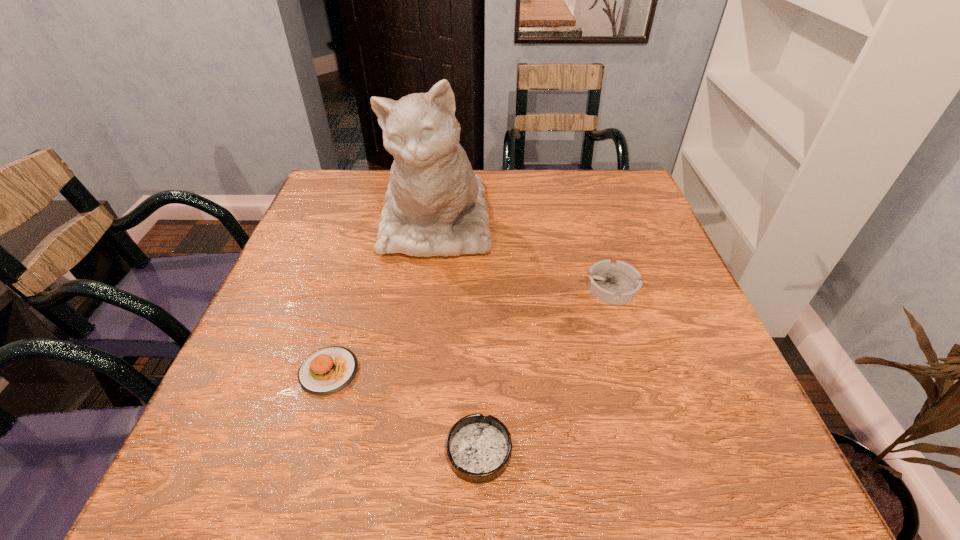
Find the location of a particular element. blank space at the far right corner of the desktop is located at coordinates (606, 208).

In order to click on free space between the food and the cat in this screenshot , I will do `click(382, 297)`.

Locate an element on the screen. The image size is (960, 540). free space that is in between the nearest object and the third farthest object is located at coordinates (404, 411).

Identify the location of free space between the rightmost object and the third farthest object. The width and height of the screenshot is (960, 540). (469, 329).

The width and height of the screenshot is (960, 540). I want to click on free area in between the third farthest object and the nearest object, so click(404, 411).

You are a GUI agent. You are given a task and a screenshot of the screen. Output one action in this format:
    pyautogui.click(x=<x>, y=<y>)
    Task: Click on the unoccupied area between the cat and the right ashtray
    Image resolution: width=960 pixels, height=540 pixels.
    Given the screenshot: What is the action you would take?
    pyautogui.click(x=523, y=255)

Locate an element on the screen. empty location between the shortest object and the cat is located at coordinates (458, 338).

Where is `unoccupied area between the shortest object and the taller ashtray`? unoccupied area between the shortest object and the taller ashtray is located at coordinates (544, 369).

Locate an element on the screen. vacant space in between the third farthest object and the tallest object is located at coordinates (382, 297).

At what (x,y) coordinates should I click in order to perform the action: click on vacant area between the nearest object and the taller ashtray. Please return your answer as a coordinate pair (x, y). This screenshot has width=960, height=540. Looking at the image, I should click on (544, 369).